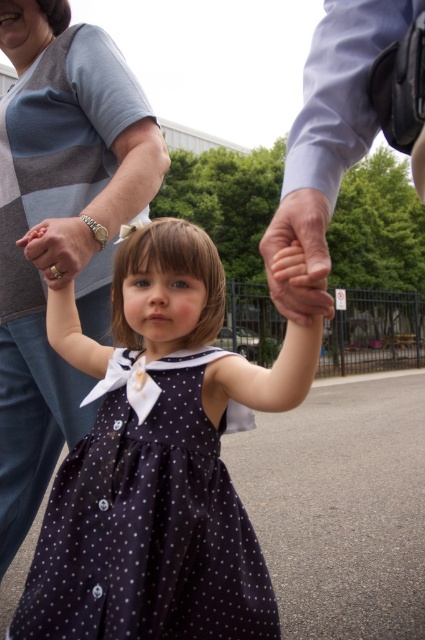
Question: Is dark blue polka dot dress at center bigger than light blue shirt at upper right?

Choices:
 (A) yes
 (B) no

Answer: (A)

Question: Is light blue shirt at upper right to the right of matte gold ring at center from the viewer's perspective?

Choices:
 (A) no
 (B) yes

Answer: (B)

Question: Does dark blue polka dot dress at center have a larger size compared to light blue shirt at upper right?

Choices:
 (A) no
 (B) yes

Answer: (B)

Question: Estimate the real-world distances between objects in this image. Which object is farther from the matte gray sweater at upper left?

Choices:
 (A) smooth skin hand at center
 (B) dark blue polka dot dress at center
 (C) light blue shirt at upper right

Answer: (A)

Question: Which object appears farthest from the camera in this image?

Choices:
 (A) dark blue polka dot dress at center
 (B) matte gold ring at center
 (C) smooth skin hand at center
 (D) light blue shirt at upper right

Answer: (B)

Question: Among these objects, which one is nearest to the camera?

Choices:
 (A) dark blue polka dot dress at center
 (B) matte gray sweater at upper left
 (C) light blue shirt at upper right

Answer: (C)